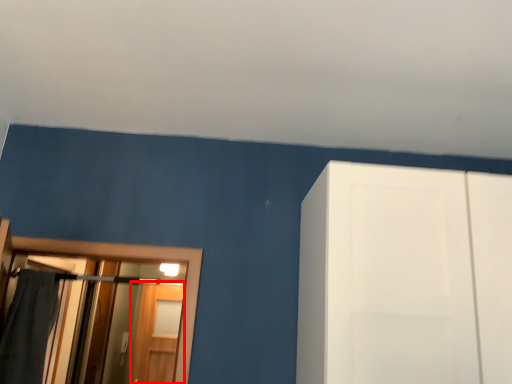
Question: Where is screen door (annotated by the red box) located in relation to bath towel in the image?

Choices:
 (A) left
 (B) right

Answer: (B)